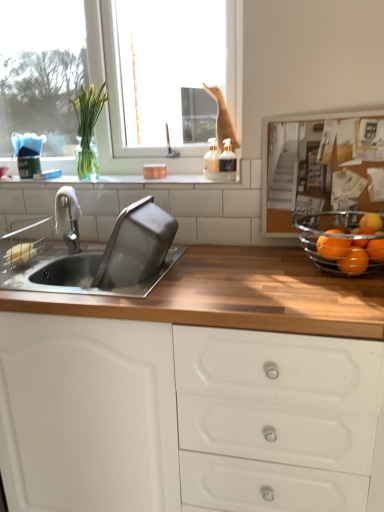
At what (x,y) coordinates should I click in order to perform the action: click on free spot to the left of orange matte/orange at right, which is the 2th orange from left to right. Please return your answer as a coordinate pair (x, y). Looking at the image, I should click on (286, 279).